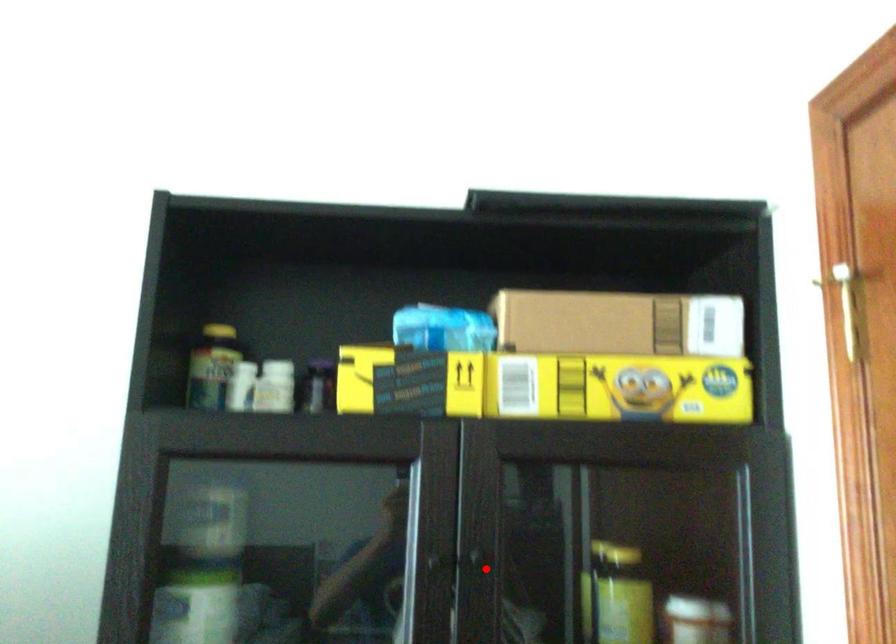
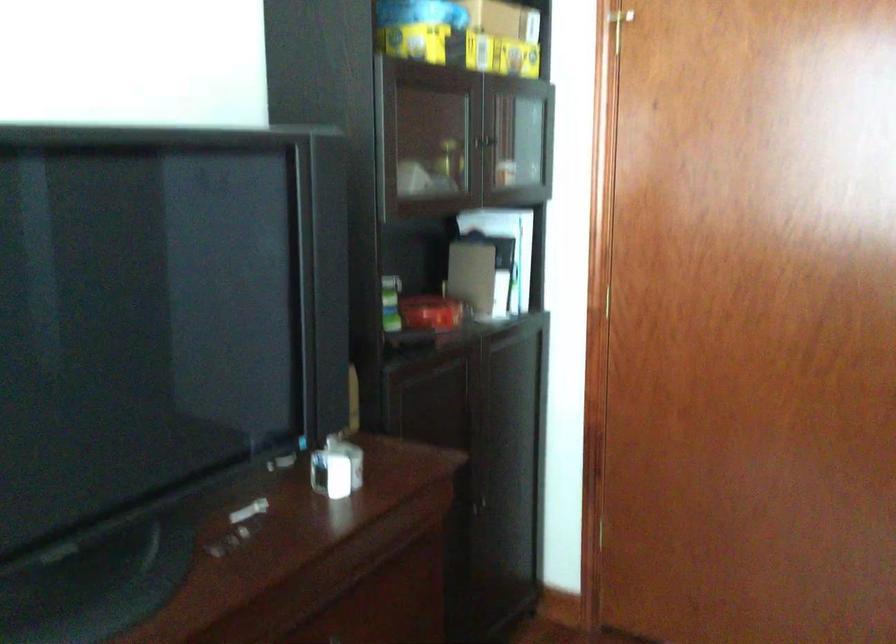
Question: I am providing you with two images of the same scene from different viewpoints. Given a red point in image1, look at the same physical point in image2. Is it:

Choices:
 (A) Closer to the viewpoint
 (B) Farther from the viewpoint

Answer: (B)